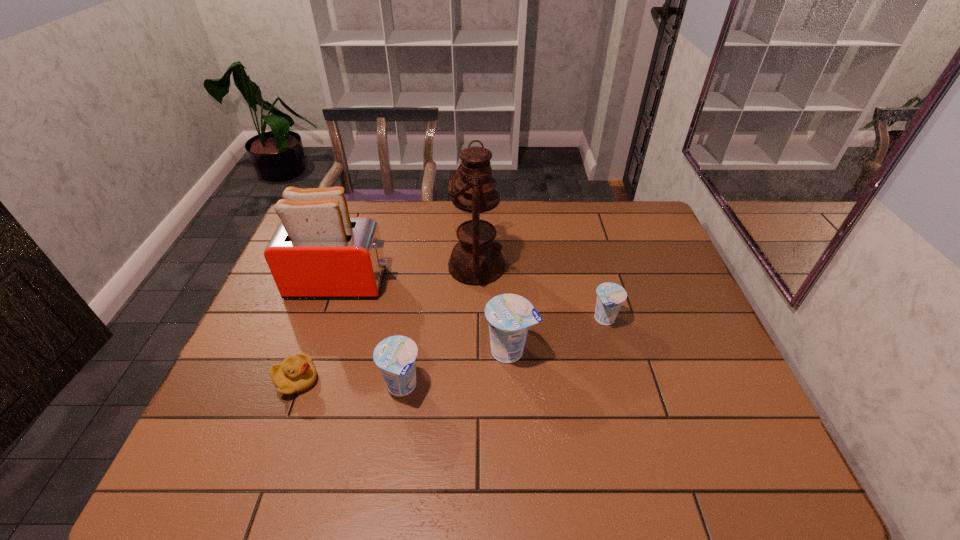
Where is `free space for a new yogurt on the right`? The image size is (960, 540). free space for a new yogurt on the right is located at coordinates (688, 292).